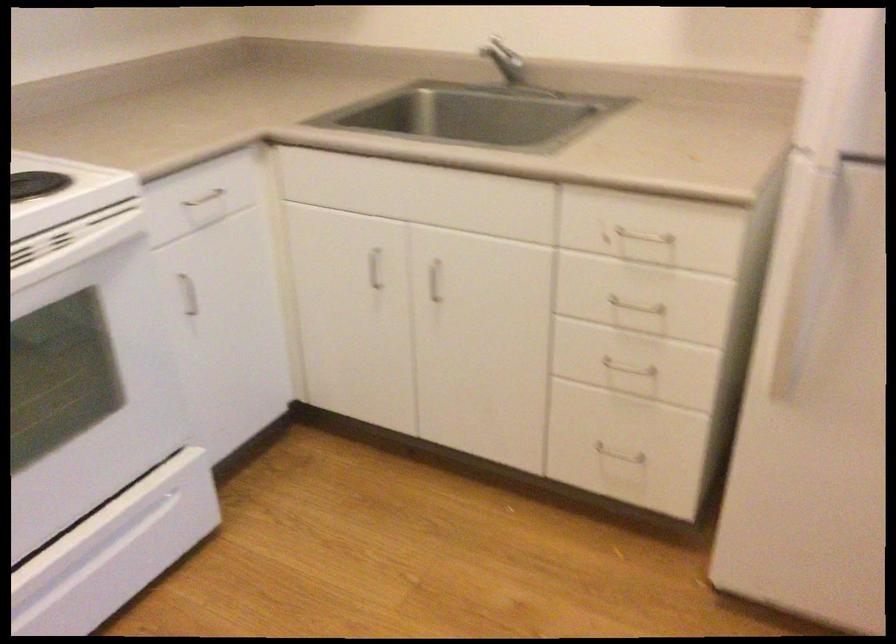
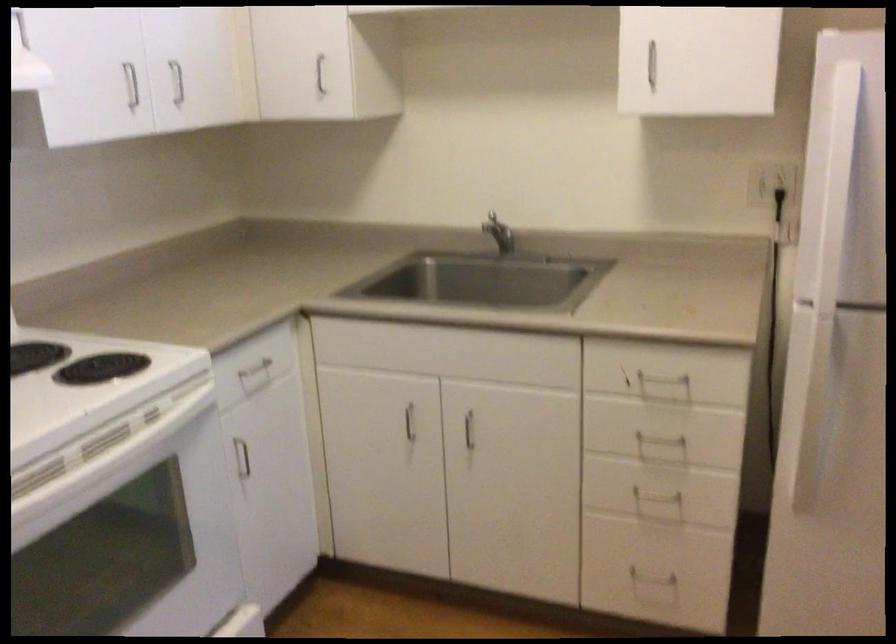
Locate, in the second image, the point that corresponds to the point at 192,290 in the first image.

(242, 458)